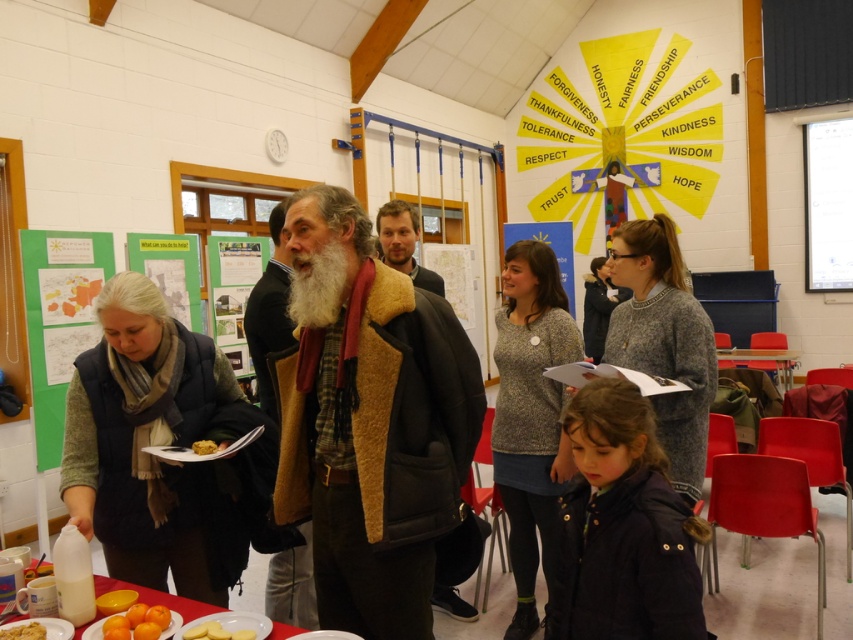
Is dark blue jacket at lower center above yellow matte cake at center?

No.

Does dark blue jacket at lower center have a greater height compared to yellow matte cake at center?

Correct, dark blue jacket at lower center is much taller as yellow matte cake at center.

Between point (679, 595) and point (210, 444), which one is positioned behind?

Point (210, 444)

The width and height of the screenshot is (853, 640). Identify the location of dark blue jacket at lower center. (624, 528).

Looking at this image, can you confirm if brown shearling jacket at center is positioned below smooth orange cake at center?

Actually, brown shearling jacket at center is above smooth orange cake at center.

Which is more to the right, brown shearling jacket at center or smooth orange cake at center?

From the viewer's perspective, brown shearling jacket at center appears more on the right side.

Measure the distance between brown shearling jacket at center and camera.

brown shearling jacket at center and camera are 1.72 meters apart from each other.

Locate an element on the screen. brown shearling jacket at center is located at coordinates (368, 419).

Does dark blue jacket at lower center have a smaller size compared to wooden table at lower right?

Correct, dark blue jacket at lower center occupies less space than wooden table at lower right.

Who is higher up, dark blue jacket at lower center or wooden table at lower right?

wooden table at lower right

Image resolution: width=853 pixels, height=640 pixels. Describe the element at coordinates (624, 528) in the screenshot. I see `dark blue jacket at lower center` at that location.

Image resolution: width=853 pixels, height=640 pixels. I want to click on dark blue jacket at lower center, so click(x=624, y=528).